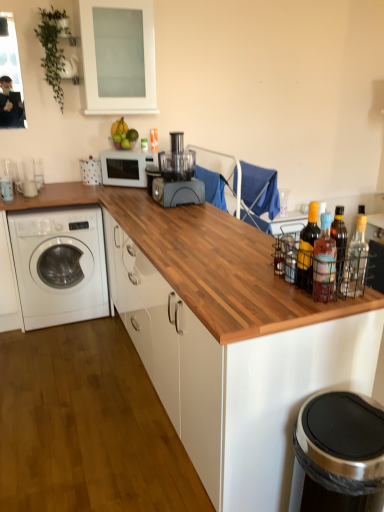
Question: Is wooden at center to the right of matte yellow glass bottle at right, which is the second bottle from back to front, from the viewer's perspective?

Choices:
 (A) no
 (B) yes

Answer: (A)

Question: Is wooden at center positioned in front of matte yellow glass bottle at right, which is the second bottle from back to front?

Choices:
 (A) no
 (B) yes

Answer: (B)

Question: Considering the relative sizes of wooden at center and matte yellow glass bottle at right, which is the second bottle from back to front, in the image provided, is wooden at center taller than matte yellow glass bottle at right, which is the second bottle from back to front,?

Choices:
 (A) yes
 (B) no

Answer: (A)

Question: Is the surface of wooden at center in direct contact with matte yellow glass bottle at right, which is the second bottle from back to front?

Choices:
 (A) no
 (B) yes

Answer: (A)

Question: Is wooden at center at the left side of matte yellow glass bottle at right, which is the second bottle from back to front?

Choices:
 (A) no
 (B) yes

Answer: (B)

Question: Is transparent glass cabinet at upper center situated inside wooden at center or outside?

Choices:
 (A) outside
 (B) inside

Answer: (A)

Question: In terms of height, does transparent glass cabinet at upper center look taller or shorter compared to wooden at center?

Choices:
 (A) short
 (B) tall

Answer: (A)

Question: Looking at their shapes, would you say transparent glass cabinet at upper center is wider or thinner than wooden at center?

Choices:
 (A) wide
 (B) thin

Answer: (B)

Question: Relative to wooden at center, is transparent glass cabinet at upper center in front or behind?

Choices:
 (A) behind
 (B) front

Answer: (A)

Question: Looking at the image, does clear glass bottle at right, placed as the 1th bottle when sorted from right to left, seem bigger or smaller compared to white matte microwave at center?

Choices:
 (A) small
 (B) big

Answer: (B)

Question: Relative to white matte microwave at center, is clear glass bottle at right, the third bottle in the left-to-right sequence, in front or behind?

Choices:
 (A) behind
 (B) front

Answer: (A)

Question: From a real-world perspective, is clear glass bottle at right, placed as the 1th bottle when sorted from right to left, positioned above or below white matte microwave at center?

Choices:
 (A) below
 (B) above

Answer: (A)

Question: Looking at their shapes, would you say clear glass bottle at right, the third bottle in the left-to-right sequence, is wider or thinner than white matte microwave at center?

Choices:
 (A) wide
 (B) thin

Answer: (A)

Question: From the image's perspective, relative to transparent glass cabinet at upper center, is matte yellow glass bottle at right, which is the second bottle from back to front, above or below?

Choices:
 (A) above
 (B) below

Answer: (B)

Question: Visually, is matte yellow glass bottle at right, the second bottle when ordered from front to back, positioned to the left or to the right of transparent glass cabinet at upper center?

Choices:
 (A) left
 (B) right

Answer: (B)